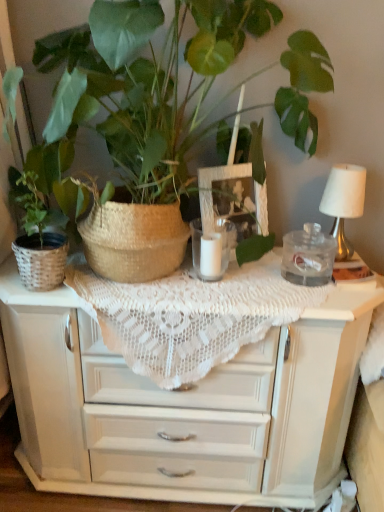
At what (x,y) coordinates should I click in order to perform the action: click on clear glass jar at center. Please return your answer as a coordinate pair (x, y). This screenshot has width=384, height=512. Looking at the image, I should click on (308, 256).

Locate an element on the screen. Image resolution: width=384 pixels, height=512 pixels. white glass candle at center is located at coordinates (222, 245).

Describe the element at coordinates (138, 92) in the screenshot. I see `green woven basket at upper left, which is counted as the 2th houseplant, starting from the left` at that location.

At what (x,y) coordinates should I click in order to perform the action: click on matte wicker basket at left, which ranks as the 1th houseplant in left-to-right order. Please return your answer as a coordinate pair (x, y). Image resolution: width=384 pixels, height=512 pixels. Looking at the image, I should click on (38, 234).

The height and width of the screenshot is (512, 384). What do you see at coordinates (38, 234) in the screenshot?
I see `matte wicker basket at left, placed as the second houseplant when sorted from right to left` at bounding box center [38, 234].

The width and height of the screenshot is (384, 512). Identify the location of white lace tablecloth at center. (190, 315).

Consider the image. Which is behind, white fabric-covered lampshade at right or white lace tablecloth at center?

white fabric-covered lampshade at right is behind.

Does white fabric-covered lampshade at right have a greater height compared to white lace tablecloth at center?

No, white fabric-covered lampshade at right is not taller than white lace tablecloth at center.

Does white fabric-covered lampshade at right have a smaller size compared to white lace tablecloth at center?

Yes, white fabric-covered lampshade at right is smaller than white lace tablecloth at center.

This screenshot has height=512, width=384. What are the coordinates of `table lamp above the white lace tablecloth at center (from a real-world perspective)` in the screenshot? It's located at (344, 202).

Which object is positioned more to the left, white glass candle at center or white lace tablecloth at center?

From the viewer's perspective, white lace tablecloth at center appears more on the left side.

Between white glass candle at center and white lace tablecloth at center, which one has smaller width?

white glass candle at center.

Based on the photo, can you confirm if white glass candle at center is smaller than white lace tablecloth at center?

Yes.

From the picture: Are white glass candle at center and white lace tablecloth at center located far from each other?

No, white glass candle at center is in close proximity to white lace tablecloth at center.

Relative to white fabric-covered lampshade at right, is green woven basket at upper left, the first houseplant when ordered from right to left, in front or behind?

In the image, green woven basket at upper left, the first houseplant when ordered from right to left, appears in front of white fabric-covered lampshade at right.

From the image's perspective, which one is positioned higher, green woven basket at upper left, the first houseplant when ordered from right to left, or white fabric-covered lampshade at right?

green woven basket at upper left, the first houseplant when ordered from right to left, appears higher in the image.

Is green woven basket at upper left, the first houseplant when ordered from right to left, at the left side of white fabric-covered lampshade at right?

Yes.

Is white glass candle at center aimed at white fabric-covered lampshade at right?

No, white glass candle at center is not turned towards white fabric-covered lampshade at right.

Between point (229, 225) and point (322, 196), which one is positioned behind?

The point (322, 196) is more distant.

Considering the sizes of objects white glass candle at center and white fabric-covered lampshade at right in the image provided, who is wider, white glass candle at center or white fabric-covered lampshade at right?

white fabric-covered lampshade at right.

Is white glass candle at center not close to white fabric-covered lampshade at right?

No, white glass candle at center is not far away from white fabric-covered lampshade at right.

Can green woven basket at upper left, which is counted as the 2th houseplant, starting from the left, be found inside white glass candle at center?

Actually, green woven basket at upper left, which is counted as the 2th houseplant, starting from the left, is outside white glass candle at center.

How many degrees apart are the facing directions of white glass candle at center and green woven basket at upper left, the first houseplant when ordered from right to left?

The angle between the facing direction of white glass candle at center and the facing direction of green woven basket at upper left, the first houseplant when ordered from right to left, is 0.000584 degrees.

Is white glass candle at center thinner than green woven basket at upper left, which is counted as the 2th houseplant, starting from the left?

Yes, white glass candle at center is thinner than green woven basket at upper left, which is counted as the 2th houseplant, starting from the left.

Between white glass candle at center and green woven basket at upper left, which is counted as the 2th houseplant, starting from the left, which one is positioned in front?

green woven basket at upper left, which is counted as the 2th houseplant, starting from the left, is in front.

From a real-world perspective, which is physically above, clear glass jar at center or white glass candle at center?

In real-world perspective, white glass candle at center is above.

Considering the sizes of objects clear glass jar at center and white glass candle at center in the image provided, who is shorter, clear glass jar at center or white glass candle at center?

Standing shorter between the two is clear glass jar at center.

Would you say clear glass jar at center is outside white glass candle at center?

That's correct, clear glass jar at center is outside of white glass candle at center.

Is point (292, 269) closer or farther from the camera than point (199, 251)?

Point (292, 269) is farther from the camera than point (199, 251).

Could you tell me if white glass candle at center is facing matte wicker basket at left, placed as the second houseplant when sorted from right to left?

No, white glass candle at center is not facing towards matte wicker basket at left, placed as the second houseplant when sorted from right to left.

Which object is further away from the camera, white glass candle at center or matte wicker basket at left, which ranks as the 1th houseplant in left-to-right order?

white glass candle at center is more distant.

From a real-world perspective, is white glass candle at center physically below matte wicker basket at left, which ranks as the 1th houseplant in left-to-right order?

Yes.

Image resolution: width=384 pixels, height=512 pixels. Find the location of `tablecloth in front of the white fabric-covered lampshade at right`. tablecloth in front of the white fabric-covered lampshade at right is located at coordinates (190, 315).

Identify the location of tablecloth on the left of white glass candle at center. (190, 315).

From the image, which object appears to be farther from green woven basket at upper left, the first houseplant when ordered from right to left, white fabric-covered lampshade at right or matte wicker basket at left, placed as the second houseplant when sorted from right to left?

Based on the image, white fabric-covered lampshade at right appears to be further to green woven basket at upper left, the first houseplant when ordered from right to left.

Estimate the real-world distances between objects in this image. Which object is further from clear glass jar at center, green woven basket at upper left, which is counted as the 2th houseplant, starting from the left, or matte wicker basket at left, which ranks as the 1th houseplant in left-to-right order?

matte wicker basket at left, which ranks as the 1th houseplant in left-to-right order, lies further to clear glass jar at center than the other object.

From the image, which object appears to be nearer to matte wicker basket at left, placed as the second houseplant when sorted from right to left, white glass candle at center or white fabric-covered lampshade at right?

white glass candle at center is closer to matte wicker basket at left, placed as the second houseplant when sorted from right to left.

Looking at the image, which one is located closer to matte wicker basket at left, which ranks as the 1th houseplant in left-to-right order, clear glass jar at center or white lace tablecloth at center?

white lace tablecloth at center lies closer to matte wicker basket at left, which ranks as the 1th houseplant in left-to-right order, than the other object.

Looking at this image, when comparing their distances from white fabric-covered lampshade at right, does green woven basket at upper left, the first houseplant when ordered from right to left, or white lace tablecloth at center seem further?

green woven basket at upper left, the first houseplant when ordered from right to left, lies further to white fabric-covered lampshade at right than the other object.

Looking at the image, which one is located further to matte wicker basket at left, which ranks as the 1th houseplant in left-to-right order, clear glass jar at center or white fabric-covered lampshade at right?

The object further to matte wicker basket at left, which ranks as the 1th houseplant in left-to-right order, is white fabric-covered lampshade at right.

Based on the photo, looking at the image, which one is located further to white glass candle at center, matte wicker basket at left, placed as the second houseplant when sorted from right to left, or green woven basket at upper left, which is counted as the 2th houseplant, starting from the left?

matte wicker basket at left, placed as the second houseplant when sorted from right to left, is positioned further to the anchor white glass candle at center.

Estimate the real-world distances between objects in this image. Which object is closer to green woven basket at upper left, which is counted as the 2th houseplant, starting from the left, white lace tablecloth at center or clear glass jar at center?

white lace tablecloth at center is closer to green woven basket at upper left, which is counted as the 2th houseplant, starting from the left.

You are a GUI agent. You are given a task and a screenshot of the screen. Output one action in this format:
    pyautogui.click(x=<x>, y=<y>)
    Task: Click on the houseplant between matte wicker basket at left, placed as the second houseplant when sorted from right to left, and white glass candle at center, in the horizontal direction
    This screenshot has height=512, width=384.
    Given the screenshot: What is the action you would take?
    pyautogui.click(x=138, y=92)

Find the location of a particular element. candle holder between green woven basket at upper left, the first houseplant when ordered from right to left, and white lace tablecloth at center vertically is located at coordinates (222, 245).

I want to click on houseplant between matte wicker basket at left, placed as the second houseplant when sorted from right to left, and clear glass jar at center, so click(138, 92).

Where is `glass jar between matte wicker basket at left, which ranks as the 1th houseplant in left-to-right order, and white fabric-covered lampshade at right, in the horizontal direction`? This screenshot has height=512, width=384. glass jar between matte wicker basket at left, which ranks as the 1th houseplant in left-to-right order, and white fabric-covered lampshade at right, in the horizontal direction is located at coordinates (308, 256).